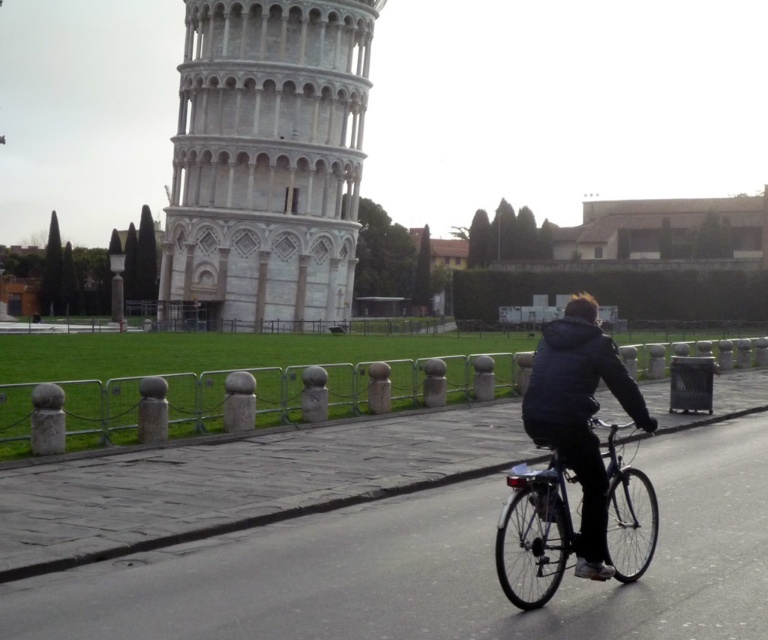
Is the position of white stone tower at center less distant than that of dark gray jacket at center?

No.

You are a GUI agent. You are given a task and a screenshot of the screen. Output one action in this format:
    pyautogui.click(x=<x>, y=<y>)
    Task: Click on the white stone tower at center
    This screenshot has height=640, width=768.
    Given the screenshot: What is the action you would take?
    pyautogui.click(x=267, y=161)

Identify the location of white stone tower at center. (267, 161).

Is white stone tower at center to the left of shiny metallic bicycle at lower right from the viewer's perspective?

Correct, you'll find white stone tower at center to the left of shiny metallic bicycle at lower right.

Which is in front, point (257, 65) or point (629, 582)?

Point (629, 582)

Measure the distance between white stone tower at center and camera.

white stone tower at center and camera are 73.31 meters apart.

Locate an element on the screen. The height and width of the screenshot is (640, 768). white stone tower at center is located at coordinates (267, 161).

Locate an element on the screen. dark gray jacket at center is located at coordinates (578, 413).

Looking at this image, can you confirm if dark gray jacket at center is wider than shiny metallic bicycle at lower right?

Correct, the width of dark gray jacket at center exceeds that of shiny metallic bicycle at lower right.

Locate an element on the screen. The image size is (768, 640). dark gray jacket at center is located at coordinates (578, 413).

Identify the location of dark gray jacket at center. (578, 413).